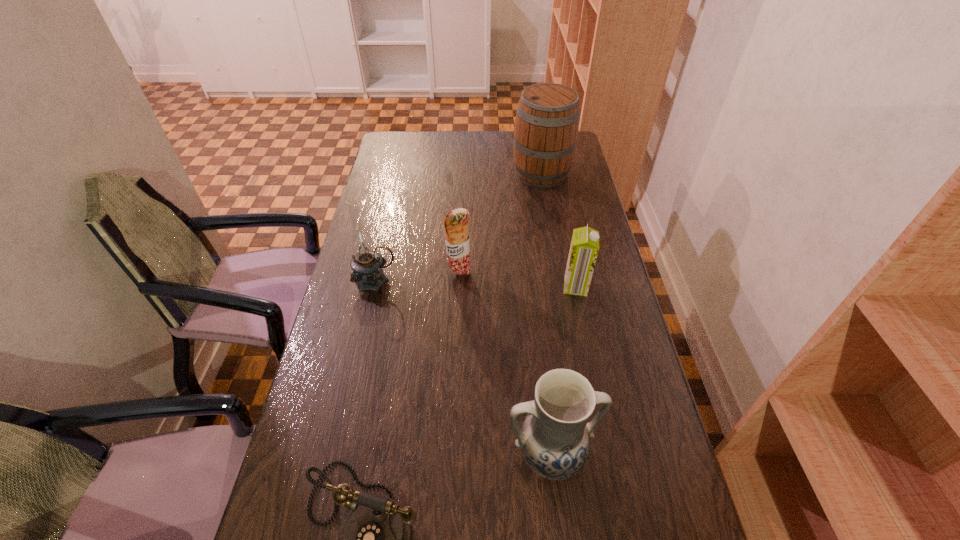
This screenshot has width=960, height=540. I want to click on cider, so click(x=546, y=128).

What are the coordinates of `oil lamp` in the screenshot? It's located at (367, 265).

Find the location of `pottery`. pottery is located at coordinates (554, 438).

Locate an element on the screen. The width and height of the screenshot is (960, 540). burrito is located at coordinates (456, 223).

Where is `soya milk`? This screenshot has width=960, height=540. soya milk is located at coordinates (584, 247).

I want to click on free space located 0.240m on the back of the cider, so click(x=534, y=131).

In order to click on free space located 0.370m on the right of the oil lamp in this screenshot , I will do `click(515, 280)`.

You are a GUI agent. You are given a task and a screenshot of the screen. Output one action in this format:
    pyautogui.click(x=<x>, y=<y>)
    Task: Click on the free space located on the right of the pottery
    Image resolution: width=960 pixels, height=540 pixels.
    Given the screenshot: What is the action you would take?
    pyautogui.click(x=629, y=456)

Identify the location of vacant space positioned 0.110m on the back of the fourth object from right to left. (461, 244).

Image resolution: width=960 pixels, height=540 pixels. I want to click on blank space located 0.180m on the front of the soya milk, so click(x=588, y=345).